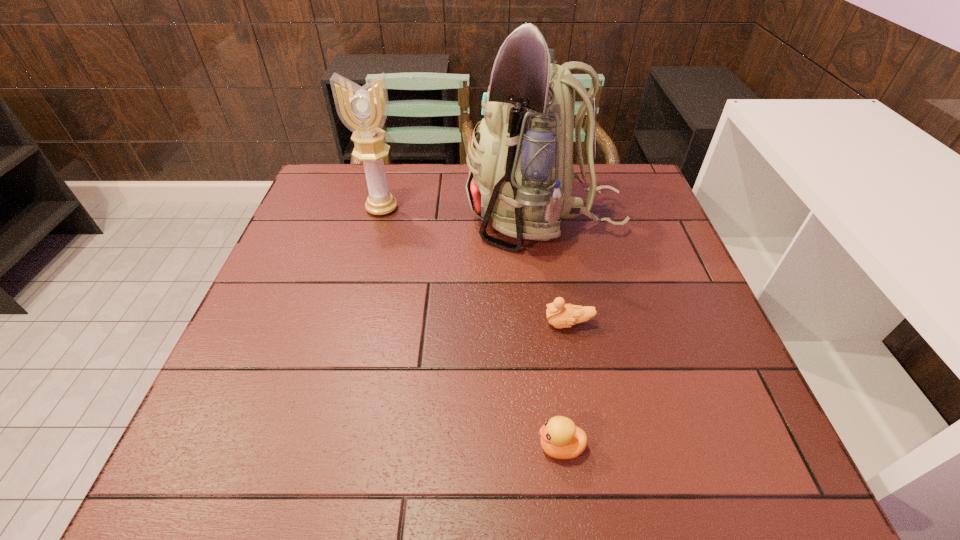
Find the location of `free space located 0.080m on the face of the nearest object`. free space located 0.080m on the face of the nearest object is located at coordinates (490, 447).

This screenshot has width=960, height=540. I want to click on free region located on the face of the nearest object, so click(437, 447).

You are a GUI agent. You are given a task and a screenshot of the screen. Output one action in this format:
    pyautogui.click(x=<x>, y=<y>)
    Task: Click on the vacant area situated on the face of the farther duckling
    Image resolution: width=960 pixels, height=540 pixels.
    Given the screenshot: What is the action you would take?
    pyautogui.click(x=361, y=324)

Image resolution: width=960 pixels, height=540 pixels. In order to click on blank space located on the face of the farther duckling in this screenshot , I will do `click(516, 324)`.

You are a GUI agent. You are given a task and a screenshot of the screen. Output one action in this format:
    pyautogui.click(x=<x>, y=<y>)
    Task: Click on the free space located 0.080m on the face of the farther duckling
    This screenshot has width=960, height=540.
    Given the screenshot: What is the action you would take?
    pyautogui.click(x=506, y=324)

Image resolution: width=960 pixels, height=540 pixels. I want to click on backpack at the far edge, so click(x=520, y=172).

Where is `award present at the far edge`? Image resolution: width=960 pixels, height=540 pixels. award present at the far edge is located at coordinates (363, 110).

At what (x,y) coordinates should I click in order to perform the action: click on object that is positioned at the near edge. Please return your answer as a coordinate pair (x, y). Looking at the image, I should click on (560, 438).

Where is `object that is at the right edge`? The width and height of the screenshot is (960, 540). object that is at the right edge is located at coordinates (520, 172).

Where is `object that is positioned at the far right corner`? Image resolution: width=960 pixels, height=540 pixels. object that is positioned at the far right corner is located at coordinates (520, 172).